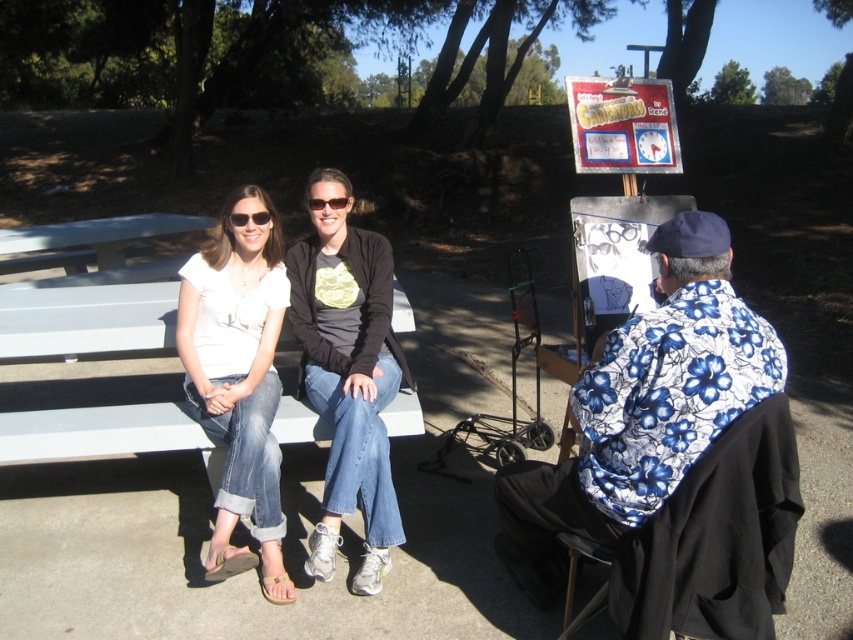
You are a photographer setting up for a group photo. You notice two people in the scene with the blue floral shirt at right and the denim jeans at center. Which clothing item appears larger in the photo?

The blue floral shirt at right appears larger than the denim jeans at center in the photo.

You are a photographer trying to capture a photo of the blue floral shirt at right and the denim jeans at center. Since you want to highlight both subjects equally, which clothing item should you adjust the camera focus on to ensure they appear proportionally sized in the frame?

The blue floral shirt at right is wider than the denim jeans at center, so to make them appear proportionally sized in the frame, focus on the blue floral shirt at right to balance their visual sizes.